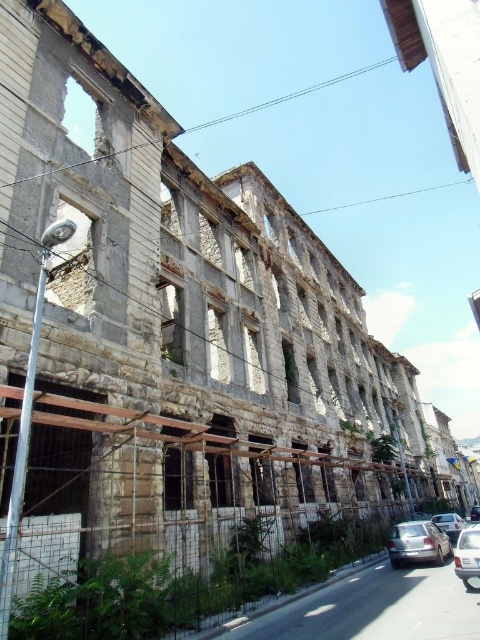
Who is positioned more to the right, silver metallic car at lower right or shiny black car at center?

shiny black car at center

Is silver metallic car at lower right positioned at the back of shiny black car at center?

No, silver metallic car at lower right is in front of shiny black car at center.

Which is behind, point (468, 586) or point (470, 518)?

Point (470, 518)

You are a GUI agent. You are given a task and a screenshot of the screen. Output one action in this format:
    pyautogui.click(x=<x>, y=<y>)
    Task: Click on the silver metallic car at lower right
    This screenshot has height=640, width=480.
    Given the screenshot: What is the action you would take?
    pyautogui.click(x=468, y=554)

Who is positioned more to the right, silver metallic sedan at lower right or shiny black car at center?

Positioned to the right is shiny black car at center.

The height and width of the screenshot is (640, 480). What do you see at coordinates (418, 544) in the screenshot?
I see `silver metallic sedan at lower right` at bounding box center [418, 544].

Locate an element on the screen. The height and width of the screenshot is (640, 480). silver metallic sedan at lower right is located at coordinates (418, 544).

What do you see at coordinates (450, 524) in the screenshot?
I see `metallic silver car at lower right` at bounding box center [450, 524].

Between metallic silver car at lower right and shiny black car at center, which one has more height?

With more height is shiny black car at center.

I want to click on metallic silver car at lower right, so click(450, 524).